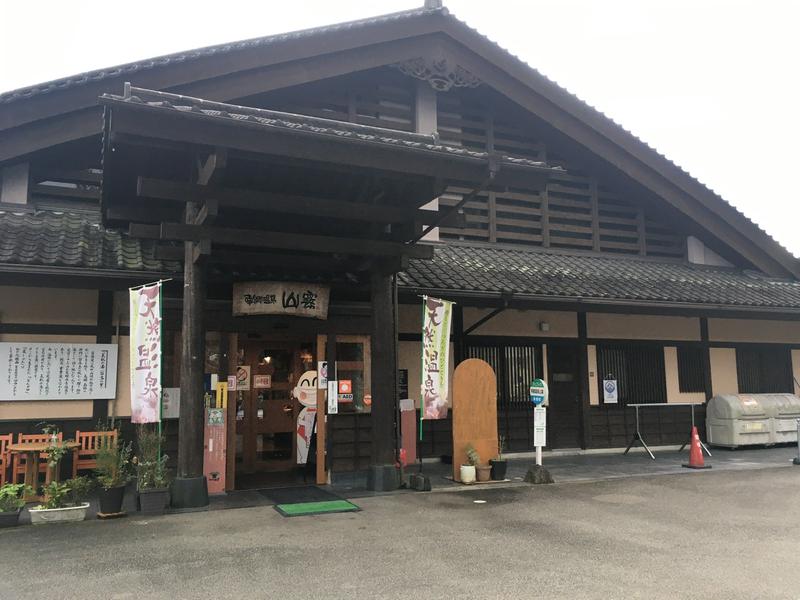
You are a GUI agent. You are given a task and a screenshot of the screen. Output one action in this format:
    pyautogui.click(x=<x>, y=<y>)
    Task: Click on the wooden table
    
    Given the screenshot: What is the action you would take?
    pyautogui.click(x=28, y=457)